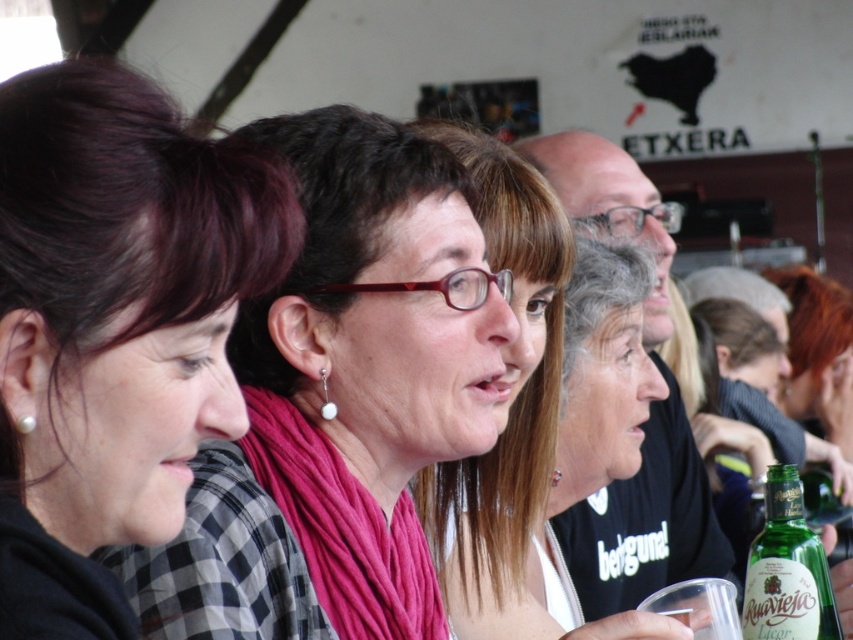
Question: Is matte pink scarf at center thinner than green glass bottle at lower right?

Choices:
 (A) no
 (B) yes

Answer: (A)

Question: Which of these objects is positioned closest to the green glass bottle at lower right?

Choices:
 (A) dark brown hair at left
 (B) pink fabric scarf at center
 (C) matte pink scarf at center

Answer: (A)

Question: Which object is positioned closest to the pink fabric scarf at center?

Choices:
 (A) green glass bottle at lower right
 (B) matte pink scarf at center
 (C) dark brown hair at left

Answer: (B)

Question: Is matte pink scarf at center to the right of green glass bottle at lower right from the viewer's perspective?

Choices:
 (A) yes
 (B) no

Answer: (B)

Question: Which object is the closest to the pink fabric scarf at center?

Choices:
 (A) matte pink scarf at center
 (B) green glass bottle at lower right
 (C) dark brown hair at left

Answer: (A)

Question: Is dark brown hair at left in front of green glass bottle at lower right?

Choices:
 (A) no
 (B) yes

Answer: (B)